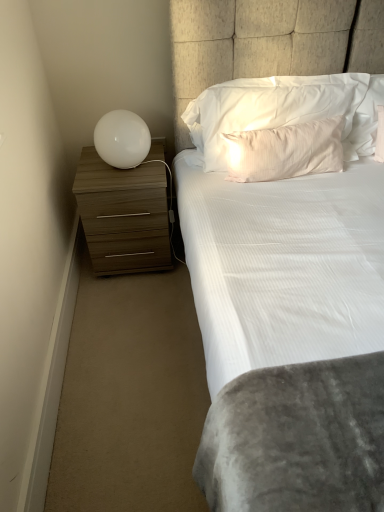
The width and height of the screenshot is (384, 512). I want to click on white soft pillow at upper center, which is the 2th pillow from bottom to top, so click(x=269, y=106).

This screenshot has width=384, height=512. What do you see at coordinates (285, 151) in the screenshot?
I see `white satin pillow at upper center, which is the 2th pillow from top to bottom` at bounding box center [285, 151].

Where is `white soft pillow at upper center, marked as the first pillow in a top-to-bottom arrangement`? The height and width of the screenshot is (512, 384). white soft pillow at upper center, marked as the first pillow in a top-to-bottom arrangement is located at coordinates (269, 106).

How many degrees apart are the facing directions of white soft pillow at upper center, which is the 2th pillow from bottom to top, and wooden chest of drawers at left?

2.03 degrees.

In the scene shown: From the image's perspective, is white soft pillow at upper center, which is the 2th pillow from bottom to top, above or below wooden chest of drawers at left?

Based on their image positions, white soft pillow at upper center, which is the 2th pillow from bottom to top, is located above wooden chest of drawers at left.

Based on the photo, which object is further away from the camera taking this photo, white soft pillow at upper center, which is the 2th pillow from bottom to top, or wooden chest of drawers at left?

wooden chest of drawers at left.

Which point is more forward, (x=262, y=95) or (x=113, y=273)?

Point (x=262, y=95)

From the image's perspective, is white soft pillow at upper center, which is the 2th pillow from bottom to top, over white satin pillow at upper center, which is the 2th pillow from top to bottom?

Yes, from the image's perspective, white soft pillow at upper center, which is the 2th pillow from bottom to top, is above white satin pillow at upper center, which is the 2th pillow from top to bottom.

Is white soft pillow at upper center, marked as the first pillow in a top-to-bottom arrangement, turned away from white satin pillow at upper center, the 1th pillow when ordered from bottom to top?

Yes, white soft pillow at upper center, marked as the first pillow in a top-to-bottom arrangement, is positioned with its back facing white satin pillow at upper center, the 1th pillow when ordered from bottom to top.

Based on the photo, considering the positions of objects white soft pillow at upper center, marked as the first pillow in a top-to-bottom arrangement, and white satin pillow at upper center, the 1th pillow when ordered from bottom to top, in the image provided, who is more to the left, white soft pillow at upper center, marked as the first pillow in a top-to-bottom arrangement, or white satin pillow at upper center, the 1th pillow when ordered from bottom to top,?

white soft pillow at upper center, marked as the first pillow in a top-to-bottom arrangement.

Who is shorter, white soft pillow at upper center, which is the 2th pillow from bottom to top, or white satin pillow at upper center, the 1th pillow when ordered from bottom to top?

white satin pillow at upper center, the 1th pillow when ordered from bottom to top.

Does white satin pillow at upper center, the 1th pillow when ordered from bottom to top, have a greater height compared to white soft pillow at upper center, marked as the first pillow in a top-to-bottom arrangement?

No, white satin pillow at upper center, the 1th pillow when ordered from bottom to top, is not taller than white soft pillow at upper center, marked as the first pillow in a top-to-bottom arrangement.

Based on the photo, from the image's perspective, is white satin pillow at upper center, the 1th pillow when ordered from bottom to top, located beneath white soft pillow at upper center, marked as the first pillow in a top-to-bottom arrangement?

Yes, from the image's perspective, white satin pillow at upper center, the 1th pillow when ordered from bottom to top, is below white soft pillow at upper center, marked as the first pillow in a top-to-bottom arrangement.

Looking at this image, who is smaller, white satin pillow at upper center, which is the 2th pillow from top to bottom, or white soft pillow at upper center, marked as the first pillow in a top-to-bottom arrangement?

white satin pillow at upper center, which is the 2th pillow from top to bottom.

Consider the image. Are white satin pillow at upper center, the 1th pillow when ordered from bottom to top, and white soft pillow at upper center, which is the 2th pillow from bottom to top, located far from each other?

No, white satin pillow at upper center, the 1th pillow when ordered from bottom to top, is not far from white soft pillow at upper center, which is the 2th pillow from bottom to top.

Which point is more distant from viewer, (x=161, y=194) or (x=236, y=167)?

The point (x=161, y=194) is farther from the camera.

Locate an element on the screen. the 2nd pillow counting from the right of the wooden chest of drawers at left is located at coordinates (285, 151).

Which of these two, wooden chest of drawers at left or white satin pillow at upper center, the 1th pillow when ordered from bottom to top, is bigger?

wooden chest of drawers at left.

Is wooden chest of drawers at left facing towards white satin pillow at upper center, the 1th pillow when ordered from bottom to top?

No, wooden chest of drawers at left is not turned towards white satin pillow at upper center, the 1th pillow when ordered from bottom to top.

Is wooden chest of drawers at left touching white soft pillow at upper center, which is the 2th pillow from bottom to top?

No, wooden chest of drawers at left is not with white soft pillow at upper center, which is the 2th pillow from bottom to top.

From the image's perspective, is wooden chest of drawers at left located above or below white soft pillow at upper center, which is the 2th pillow from bottom to top?

wooden chest of drawers at left is situated lower than white soft pillow at upper center, which is the 2th pillow from bottom to top, in the image.

Choose the correct answer: Is wooden chest of drawers at left inside white soft pillow at upper center, marked as the first pillow in a top-to-bottom arrangement, or outside it?

wooden chest of drawers at left cannot be found inside white soft pillow at upper center, marked as the first pillow in a top-to-bottom arrangement.

How many degrees apart are the facing directions of wooden chest of drawers at left and white soft pillow at upper center, marked as the first pillow in a top-to-bottom arrangement?

2.03 degrees.

Consider the image. From a real-world perspective, is white satin pillow at upper center, which is the 2th pillow from top to bottom, above or below wooden chest of drawers at left?

Clearly, from a real-world perspective, white satin pillow at upper center, which is the 2th pillow from top to bottom, is above wooden chest of drawers at left.

Which object is thinner, white satin pillow at upper center, the 1th pillow when ordered from bottom to top, or wooden chest of drawers at left?

With smaller width is white satin pillow at upper center, the 1th pillow when ordered from bottom to top.

What's the angular difference between wooden chest of drawers at left and white glossy sphere at left's facing directions?

The facing directions of wooden chest of drawers at left and white glossy sphere at left are 0.163 degrees apart.

Considering the relative sizes of wooden chest of drawers at left and white glossy sphere at left in the image provided, is wooden chest of drawers at left smaller than white glossy sphere at left?

Incorrect, wooden chest of drawers at left is not smaller in size than white glossy sphere at left.

Are wooden chest of drawers at left and white glossy sphere at left making contact?

No, wooden chest of drawers at left is not making contact with white glossy sphere at left.

Is white glossy sphere at left inside wooden chest of drawers at left?

Actually, white glossy sphere at left is outside wooden chest of drawers at left.

From the wooden chest of drawers at left, count 1st pillows forward and point to it. Please provide its 2D coordinates.

[(269, 106)]

Identify the location of pillow that appears on the left of white satin pillow at upper center, the 1th pillow when ordered from bottom to top. (269, 106).

Looking at the image, which one is located further to white satin pillow at upper center, the 1th pillow when ordered from bottom to top, white soft pillow at upper center, which is the 2th pillow from bottom to top, or white glossy sphere at left?

Based on the image, white glossy sphere at left appears to be further to white satin pillow at upper center, the 1th pillow when ordered from bottom to top.

From the image, which object appears to be nearer to white soft pillow at upper center, marked as the first pillow in a top-to-bottom arrangement, white glossy sphere at left or wooden chest of drawers at left?

white glossy sphere at left.

Based on their spatial positions, is white satin pillow at upper center, which is the 2th pillow from top to bottom, or wooden chest of drawers at left further from white glossy sphere at left?

white satin pillow at upper center, which is the 2th pillow from top to bottom.

From the image, which object appears to be nearer to white glossy sphere at left, wooden chest of drawers at left or white satin pillow at upper center, which is the 2th pillow from top to bottom?

Among the two, wooden chest of drawers at left is located nearer to white glossy sphere at left.

When comparing their distances from white glossy sphere at left, does white soft pillow at upper center, marked as the first pillow in a top-to-bottom arrangement, or wooden chest of drawers at left seem further?

white soft pillow at upper center, marked as the first pillow in a top-to-bottom arrangement, is further to white glossy sphere at left.

Looking at this image, estimate the real-world distances between objects in this image. Which object is further from wooden chest of drawers at left, white satin pillow at upper center, the 1th pillow when ordered from bottom to top, or white glossy sphere at left?

white satin pillow at upper center, the 1th pillow when ordered from bottom to top, is positioned further to the anchor wooden chest of drawers at left.

Looking at the image, which one is located further to wooden chest of drawers at left, white soft pillow at upper center, marked as the first pillow in a top-to-bottom arrangement, or white satin pillow at upper center, which is the 2th pillow from top to bottom?

white satin pillow at upper center, which is the 2th pillow from top to bottom, is further to wooden chest of drawers at left.

Estimate the real-world distances between objects in this image. Which object is closer to white soft pillow at upper center, marked as the first pillow in a top-to-bottom arrangement, wooden chest of drawers at left or white satin pillow at upper center, the 1th pillow when ordered from bottom to top?

Based on the image, white satin pillow at upper center, the 1th pillow when ordered from bottom to top, appears to be nearer to white soft pillow at upper center, marked as the first pillow in a top-to-bottom arrangement.

Locate an element on the screen. The width and height of the screenshot is (384, 512). pillow located between wooden chest of drawers at left and white satin pillow at upper center, the 1th pillow when ordered from bottom to top, in the left-right direction is located at coordinates (269, 106).

The image size is (384, 512). I want to click on pillow located between white glossy sphere at left and white satin pillow at upper center, the 1th pillow when ordered from bottom to top, in the left-right direction, so [269, 106].

I want to click on lamp between wooden chest of drawers at left and white soft pillow at upper center, which is the 2th pillow from bottom to top, so click(122, 139).

Identify the location of lamp between wooden chest of drawers at left and white satin pillow at upper center, the 1th pillow when ordered from bottom to top, in the horizontal direction. (122, 139).